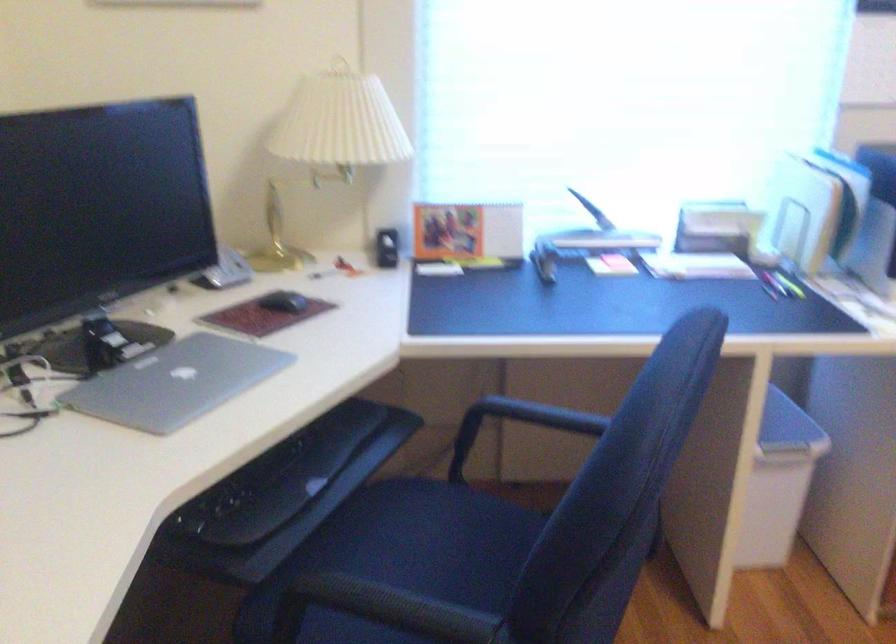
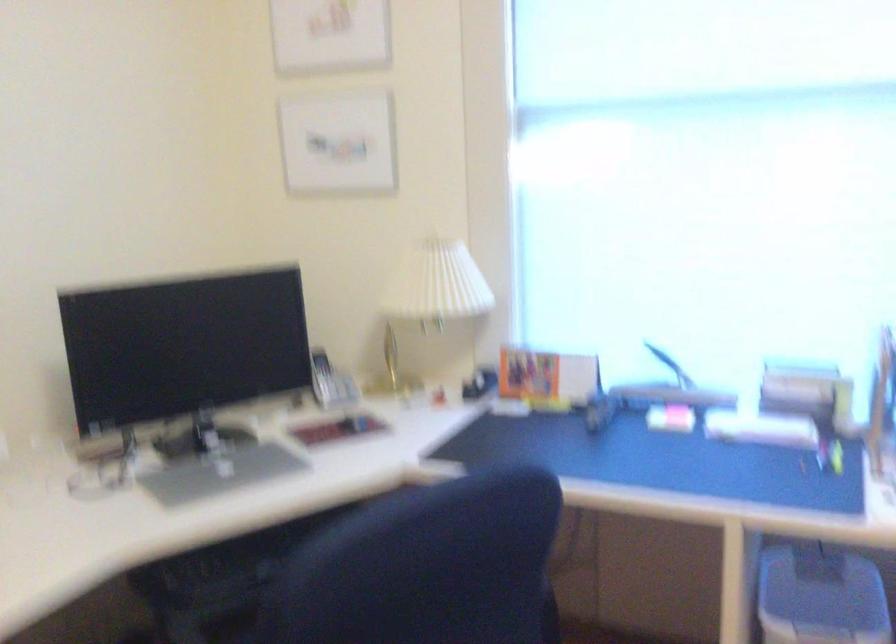
Question: In a continuous first-person perspective shot, in which direction is the camera moving?

Choices:
 (A) Left
 (B) Right
 (C) Forward
 (D) Backward

Answer: (B)